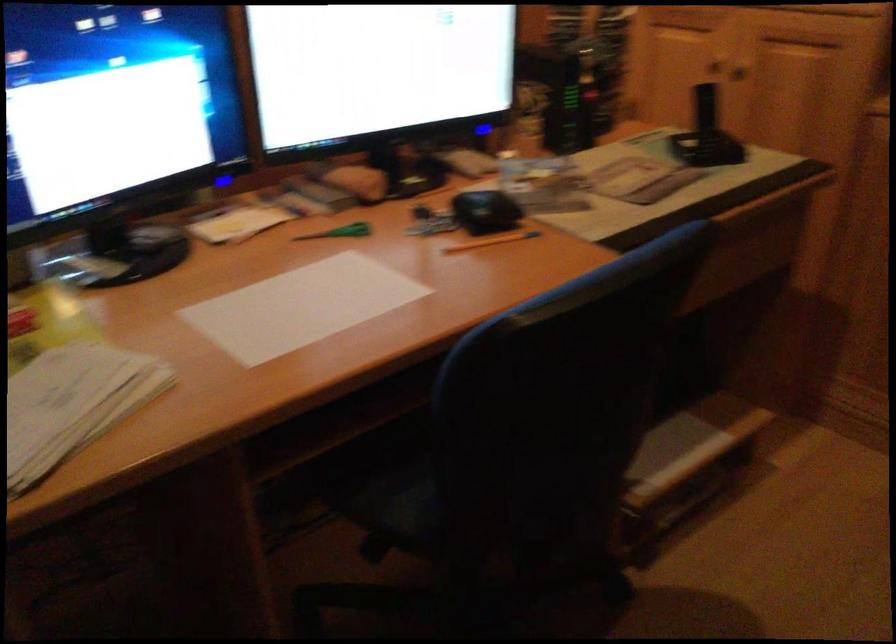
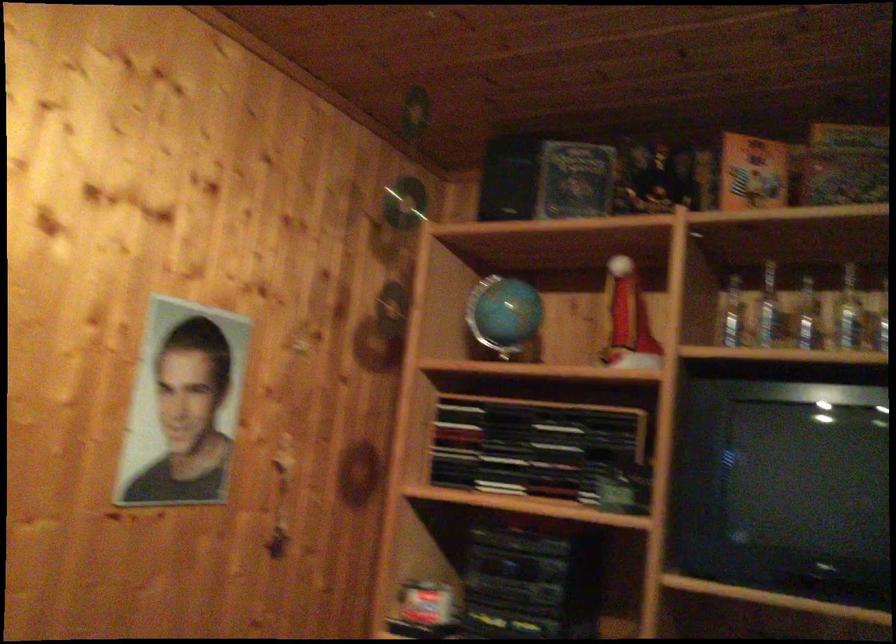
The first image is from the beginning of the video and the second image is from the end. How did the camera likely rotate when shooting the video?

The camera's rotation is toward right-up.